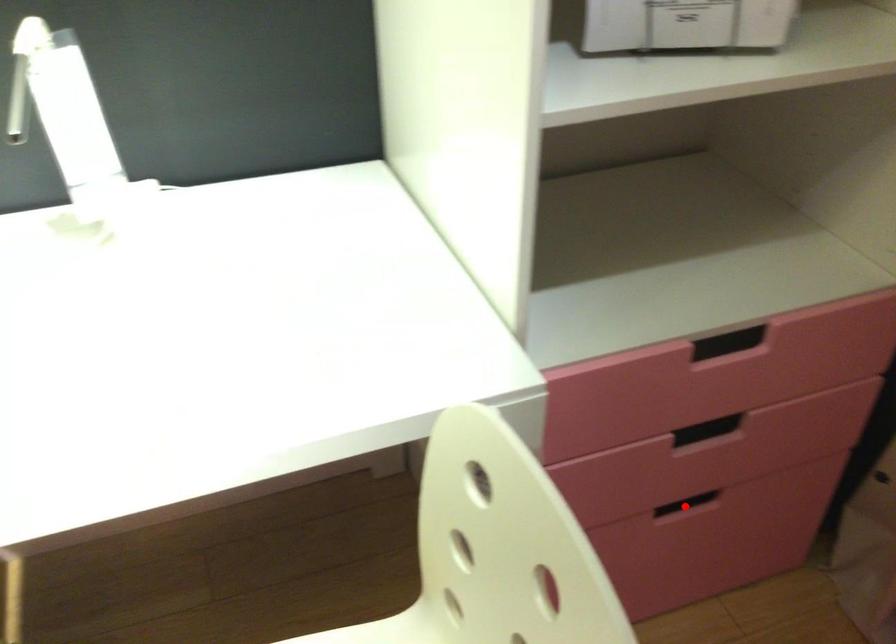
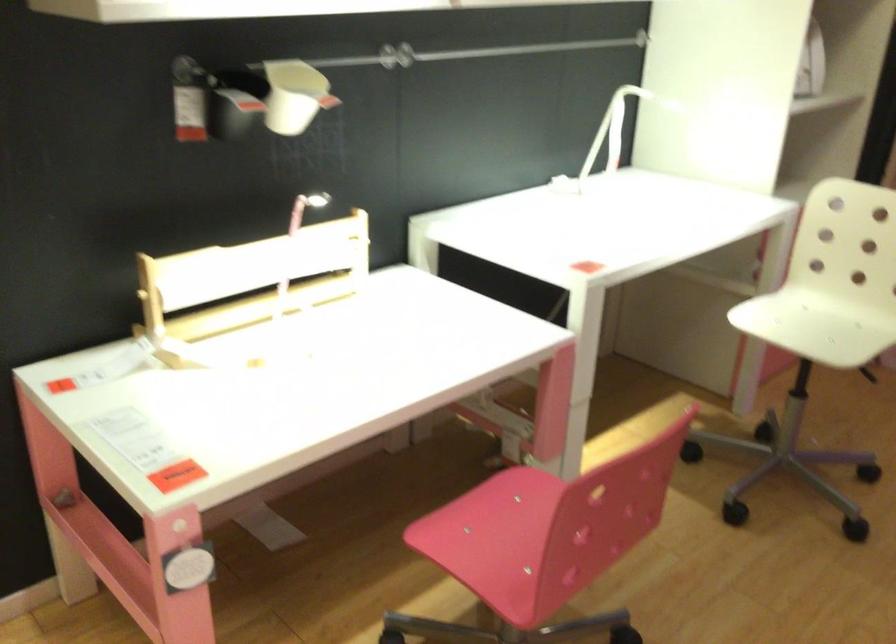
Question: I am providing you with two images of the same scene from different viewpoints. A red point is marked on the first image. Is the red point's position out of view in image 2?

Choices:
 (A) Yes
 (B) No

Answer: (A)